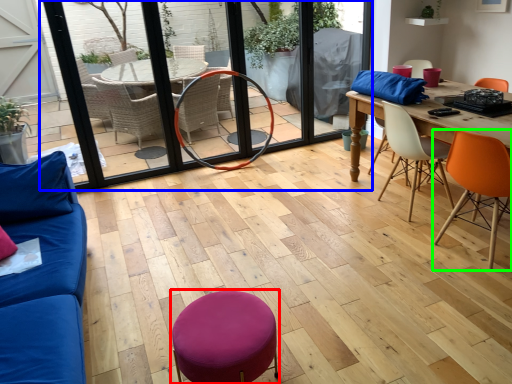
Question: Based on their relative distances, which object is nearer to bar stool (highlighted by a red box)? Choose from screen door (highlighted by a blue box) and chair (highlighted by a green box).

Choices:
 (A) screen door
 (B) chair

Answer: (B)